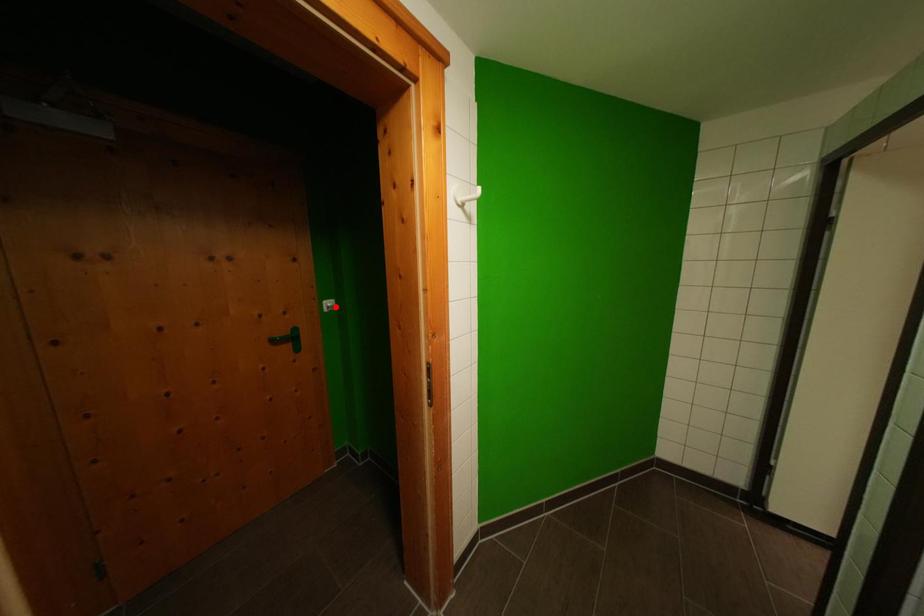
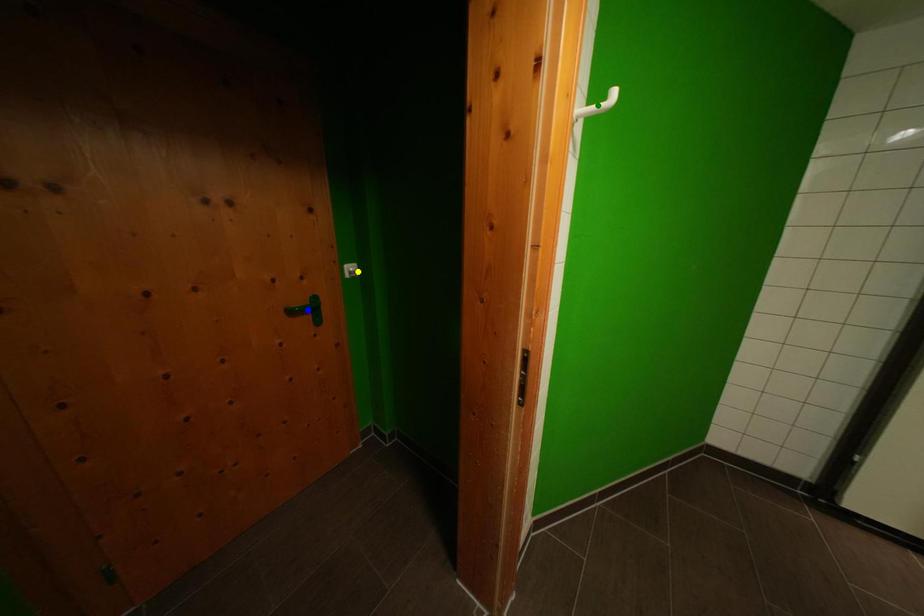
Question: I am providing you with two images of the same scene from different viewpoints. A red point is marked on the first image. You are given multiple points on the second image. Which mark in image 2 goes with the point in image 1?

Choices:
 (A) yellow point
 (B) green point
 (C) blue point

Answer: (A)